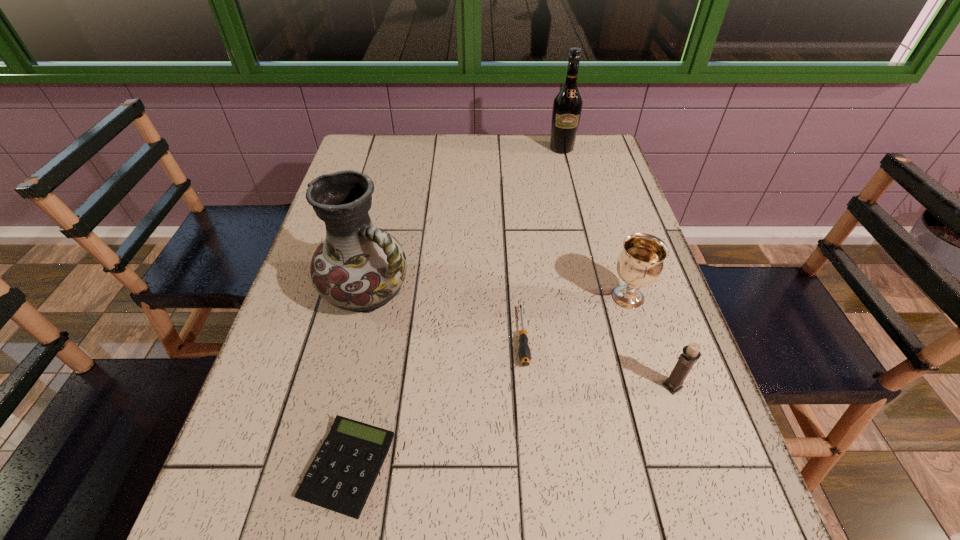
Where is `vacant space that's between the chalice and the wine bottle`? vacant space that's between the chalice and the wine bottle is located at coordinates (x=595, y=223).

Find the location of a particular element. This screenshot has height=540, width=960. vacant space that is in between the fifth tallest object and the candle holder is located at coordinates (597, 361).

Where is `free space between the chalice and the candle holder`? The height and width of the screenshot is (540, 960). free space between the chalice and the candle holder is located at coordinates (650, 342).

Where is `blank region between the wine bottle and the candle holder`? blank region between the wine bottle and the candle holder is located at coordinates (617, 267).

Identify which object is the fourth closest to the wine bottle. Please provide its 2D coordinates. Your answer should be formatted as a tuple, i.e. [(x, y)], where the tuple contains the x and y coordinates of a point satisfying the conditions above.

[(691, 353)]

Identify which object is located as the fourth nearest to the second nearest object. Please provide its 2D coordinates. Your answer should be formatted as a tuple, i.e. [(x, y)], where the tuple contains the x and y coordinates of a point satisfying the conditions above.

[(358, 267)]

Find the location of a particular element. The image size is (960, 540). free location that satisfies the following two spatial constraints: 1. on the label of the chalice; 2. on the left side of the farthest object is located at coordinates (598, 298).

This screenshot has width=960, height=540. I want to click on vacant space that satisfies the following two spatial constraints: 1. on the front side of the screwdriver; 2. on the left side of the vase, so click(357, 337).